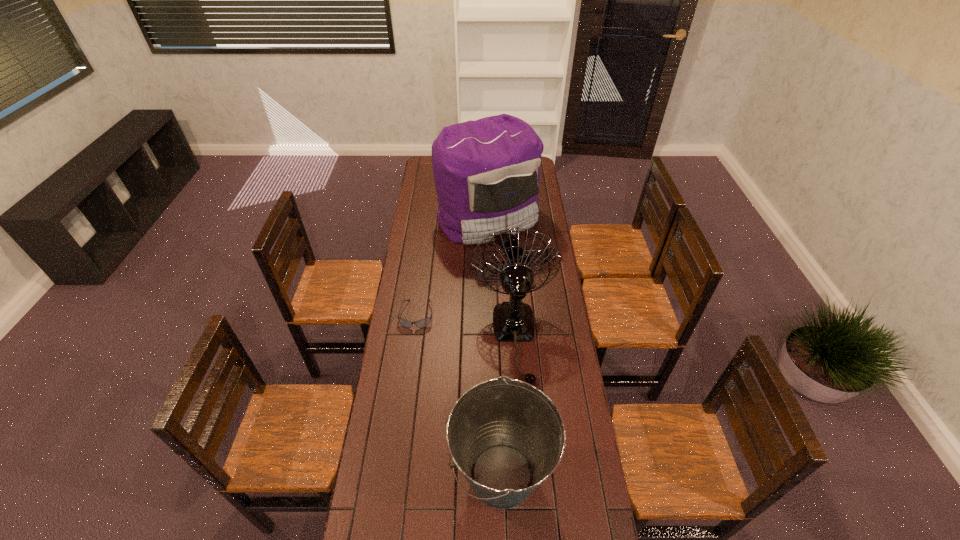
In order to click on backpack in this screenshot , I will do `click(487, 172)`.

Identify the location of fan. (513, 321).

Locate an element on the screen. Image resolution: width=960 pixels, height=540 pixels. bucket is located at coordinates (507, 437).

This screenshot has height=540, width=960. In order to click on the second shortest object in this screenshot , I will do `click(507, 437)`.

Locate an element on the screen. sunglasses is located at coordinates (425, 322).

This screenshot has width=960, height=540. In order to click on free region located on the front pocket of the farthest object in this screenshot , I will do `click(490, 302)`.

At what (x,y) coordinates should I click in order to perform the action: click on vacant space located 0.150m in front of the fan, indicating the direction of air flow. Please return your answer as a coordinate pair (x, y). Looking at the image, I should click on (520, 423).

Locate an element on the screen. free space located 0.050m with the handle on opposite sides of the second shortest object is located at coordinates (436, 475).

You are a GUI agent. You are given a task and a screenshot of the screen. Output one action in this format:
    pyautogui.click(x=<x>, y=<y>)
    Task: Click on the vacant point located with the handle on opposite sides of the second shortest object
    
    Given the screenshot: What is the action you would take?
    [369, 475]

What are the coordinates of `free region located with the handle on opposite sides of the second shortest object` in the screenshot? It's located at coord(436,475).